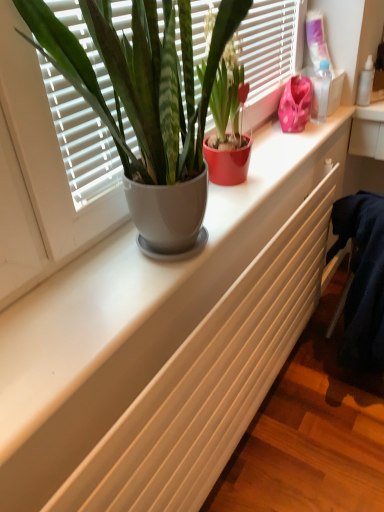
In order to click on unoccupied area in front of transparent plastic bottle at upper right, the first toiletry in the left-to-right sequence in this screenshot , I will do `click(315, 135)`.